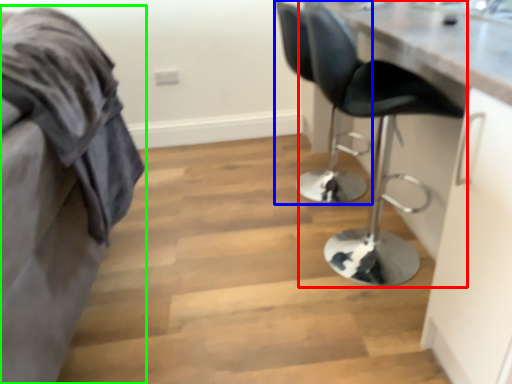
Question: Which object is positioned farthest from chair (highlighted by a red box)? Select from chair (highlighted by a blue box) and furniture (highlighted by a green box).

Choices:
 (A) chair
 (B) furniture

Answer: (A)